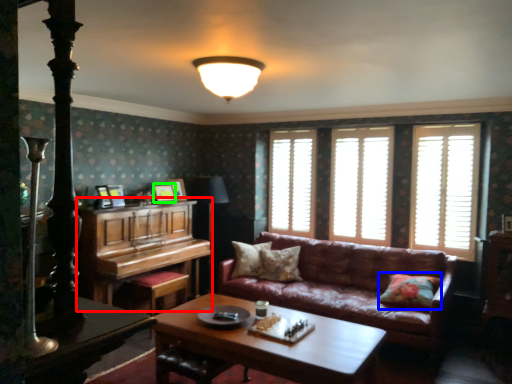
Question: Which object is the closest to the piano (highlighted by a red box)? Choose among these: pillow (highlighted by a blue box) or picture frame (highlighted by a green box).

Choices:
 (A) pillow
 (B) picture frame

Answer: (B)